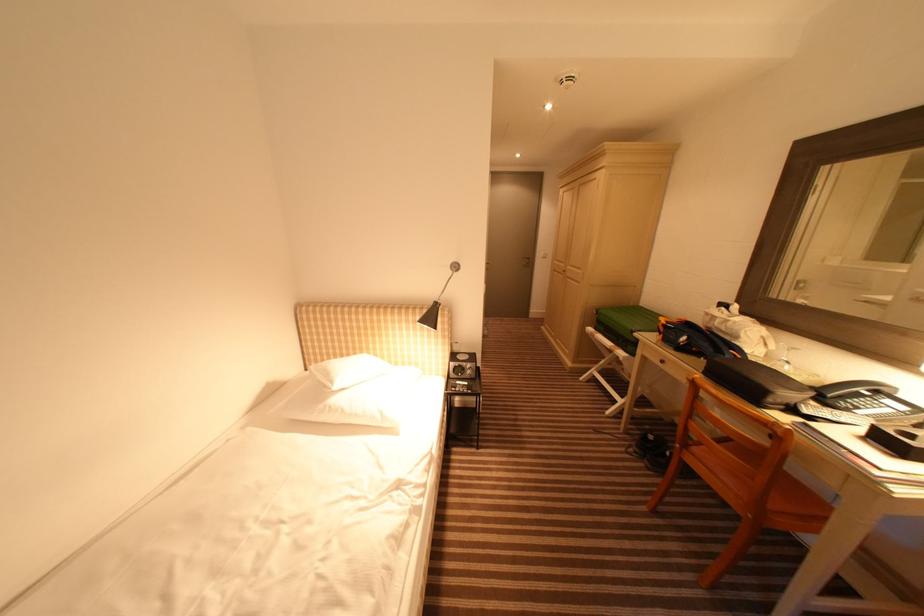
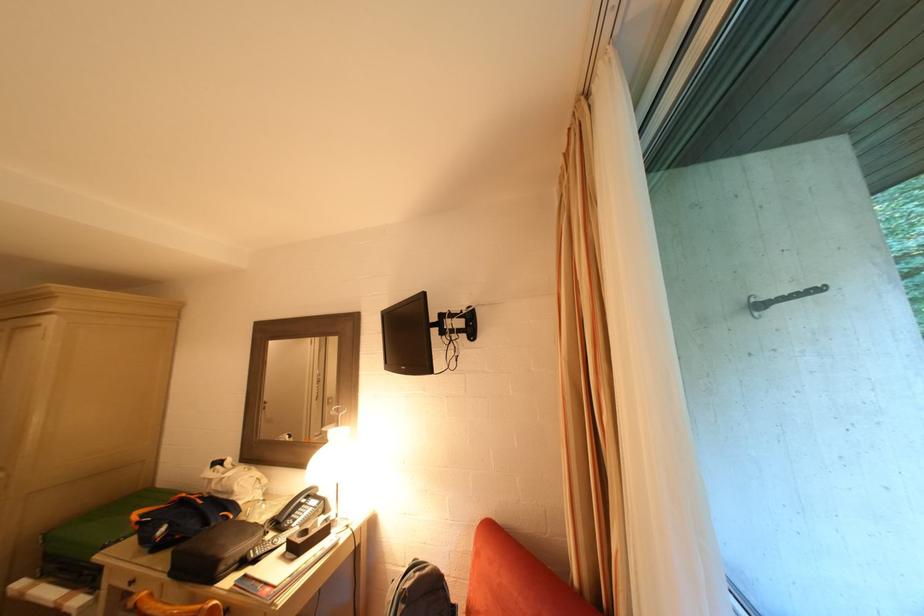
The point at (866, 397) is marked in the first image. Where is the corresponding point in the second image?

(306, 508)